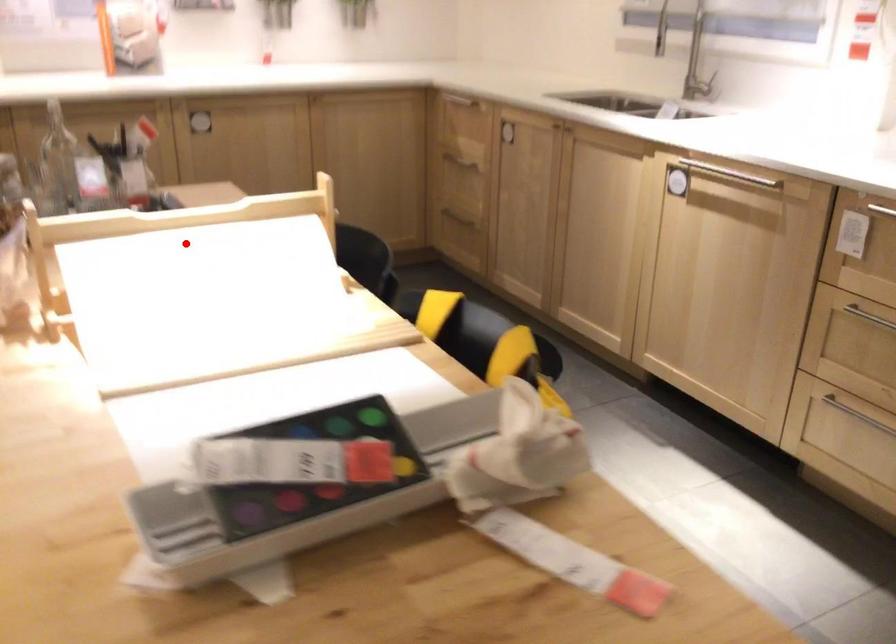
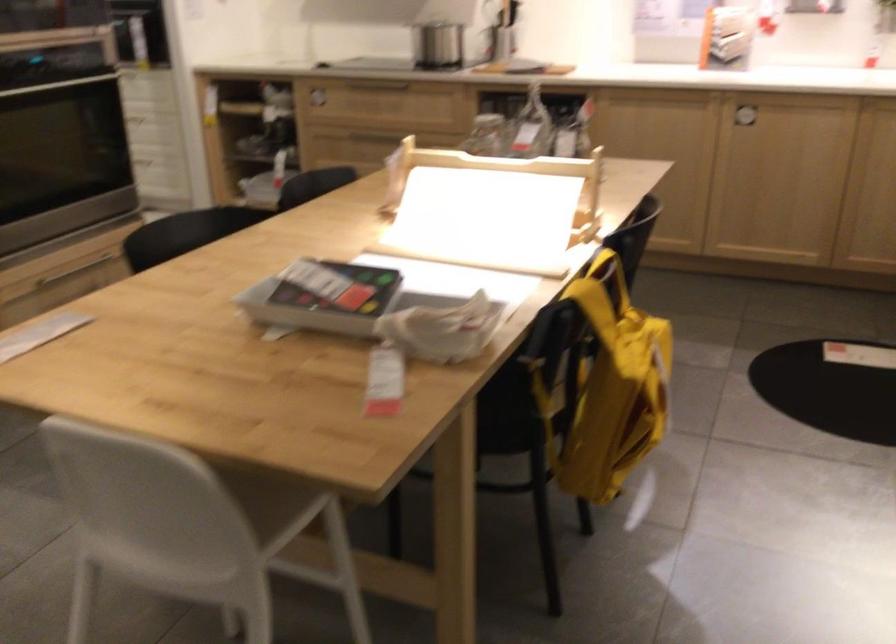
Find the pixel in the second image that matches the highlighted location in the first image.

(500, 178)